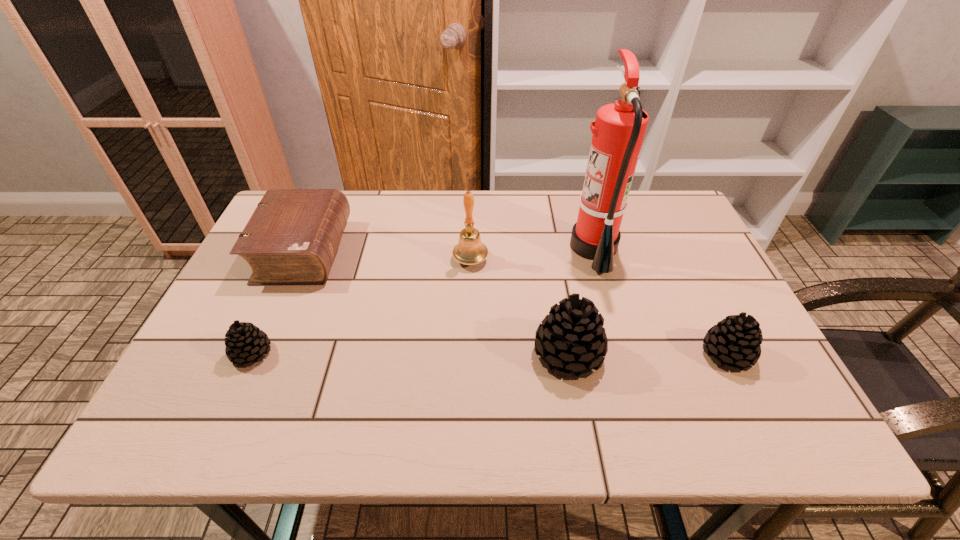
Where is `free space that is in between the shortest pinecone and the rightmost object`? The height and width of the screenshot is (540, 960). free space that is in between the shortest pinecone and the rightmost object is located at coordinates (490, 354).

What are the coordinates of `free space between the Bible and the fire extinguisher` in the screenshot? It's located at (448, 249).

Find the location of a particular element. The width and height of the screenshot is (960, 540). empty space between the Bible and the second pinecone from left to right is located at coordinates (436, 302).

Identify which object is the fifth nearest to the bell. Please provide its 2D coordinates. Your answer should be formatted as a tuple, i.e. [(x, y)], where the tuple contains the x and y coordinates of a point satisfying the conditions above.

[(735, 341)]

The image size is (960, 540). In order to click on the closest object relative to the shortest pinecone in this screenshot , I will do `click(292, 237)`.

You are a GUI agent. You are given a task and a screenshot of the screen. Output one action in this format:
    pyautogui.click(x=<x>, y=<y>)
    Task: Click on the pinecone that is the third closest to the Bible
    The height and width of the screenshot is (540, 960).
    Given the screenshot: What is the action you would take?
    pyautogui.click(x=735, y=341)

Choose which pinecone is the second nearest neighbor to the Bible. Please provide its 2D coordinates. Your answer should be formatted as a tuple, i.e. [(x, y)], where the tuple contains the x and y coordinates of a point satisfying the conditions above.

[(572, 338)]

The width and height of the screenshot is (960, 540). In order to click on blank space that satisfies the following two spatial constraints: 1. on the spine side of the third object from left to right; 2. on the left side of the Bible in this screenshot , I will do `click(300, 260)`.

The image size is (960, 540). What are the coordinates of `free spot that satisfies the following two spatial constraints: 1. on the back side of the second tallest object; 2. on the spine side of the Bible` in the screenshot? It's located at (470, 251).